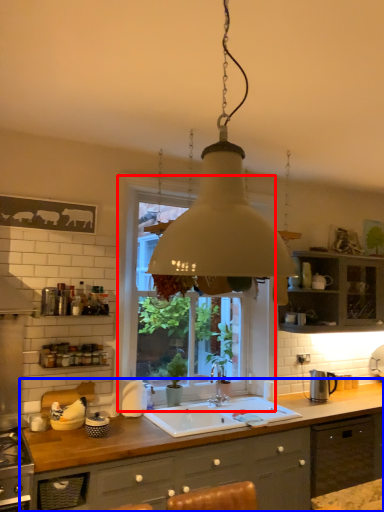
Question: Which object appears farthest to the camera in this image, window (highlighted by a red box) or countertop (highlighted by a blue box)?

Choices:
 (A) window
 (B) countertop

Answer: (A)